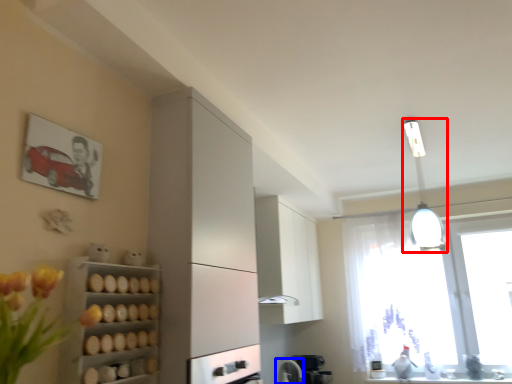
Question: Among these objects, which one is farthest to the camera, light fixture (highlighted by a red box) or appliance (highlighted by a blue box)?

Choices:
 (A) light fixture
 (B) appliance

Answer: (B)